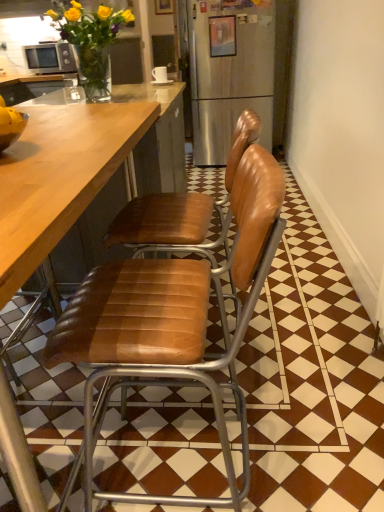
Question: Can you confirm if wooden picture frame at upper center, which is the 1th picture frame from back to front, is positioned to the left of leather at center, the second chair positioned from the back?

Choices:
 (A) no
 (B) yes

Answer: (B)

Question: From the image's perspective, is wooden picture frame at upper center, which is the 1th picture frame from back to front, on top of leather at center, which appears as the 1th chair when viewed from the front?

Choices:
 (A) no
 (B) yes

Answer: (B)

Question: Considering the relative positions of wooden picture frame at upper center, marked as the 2th picture frame in a right-to-left arrangement, and leather at center, which appears as the 1th chair when viewed from the front, in the image provided, is wooden picture frame at upper center, marked as the 2th picture frame in a right-to-left arrangement, in front of leather at center, which appears as the 1th chair when viewed from the front,?

Choices:
 (A) no
 (B) yes

Answer: (A)

Question: Is wooden picture frame at upper center, the 1th picture frame in the top-to-bottom sequence, positioned behind leather at center, the second chair positioned from the back?

Choices:
 (A) yes
 (B) no

Answer: (A)

Question: Is wooden picture frame at upper center, which appears as the 2th picture frame when ordered from the bottom, beside leather at center, which appears as the 1th chair when viewed from the front?

Choices:
 (A) yes
 (B) no

Answer: (B)

Question: Is point (230, 462) closer or farther from the camera than point (162, 206)?

Choices:
 (A) farther
 (B) closer

Answer: (B)

Question: Considering the positions of leather at center, the second chair positioned from the back, and brown leather chair at center, which ranks as the 1th chair in back-to-front order, in the image, is leather at center, the second chair positioned from the back, wider or thinner than brown leather chair at center, which ranks as the 1th chair in back-to-front order,?

Choices:
 (A) thin
 (B) wide

Answer: (B)

Question: Looking at the image, does leather at center, which appears as the 1th chair when viewed from the front, seem bigger or smaller compared to brown leather chair at center, the 2th chair from the front?

Choices:
 (A) small
 (B) big

Answer: (A)

Question: From the image's perspective, is leather at center, which appears as the 1th chair when viewed from the front, above or below brown leather chair at center, the 2th chair from the front?

Choices:
 (A) below
 (B) above

Answer: (A)

Question: From a real-world perspective, is white ceramic mug at upper center above or below metallic silver bowl at left?

Choices:
 (A) above
 (B) below

Answer: (B)

Question: Is white ceramic mug at upper center situated inside metallic silver bowl at left or outside?

Choices:
 (A) inside
 (B) outside

Answer: (B)

Question: In terms of width, does white ceramic mug at upper center look wider or thinner when compared to metallic silver bowl at left?

Choices:
 (A) thin
 (B) wide

Answer: (A)

Question: Would you say white ceramic mug at upper center is to the left or to the right of metallic silver bowl at left in the picture?

Choices:
 (A) right
 (B) left

Answer: (A)

Question: In terms of width, does brown leather chair at center, the 2th chair from the front, look wider or thinner when compared to matte silver microwave at upper left?

Choices:
 (A) thin
 (B) wide

Answer: (B)

Question: From a real-world perspective, is brown leather chair at center, the 2th chair from the front, physically located above or below matte silver microwave at upper left?

Choices:
 (A) below
 (B) above

Answer: (A)